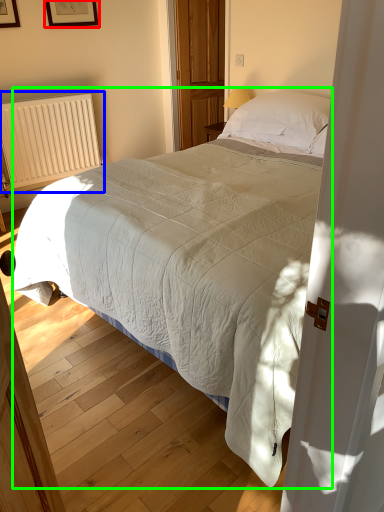
Question: Which object is positioned closest to picture frame (highlighted by a red box)? Select from radiator (highlighted by a blue box) and bed (highlighted by a green box).

Choices:
 (A) radiator
 (B) bed

Answer: (A)